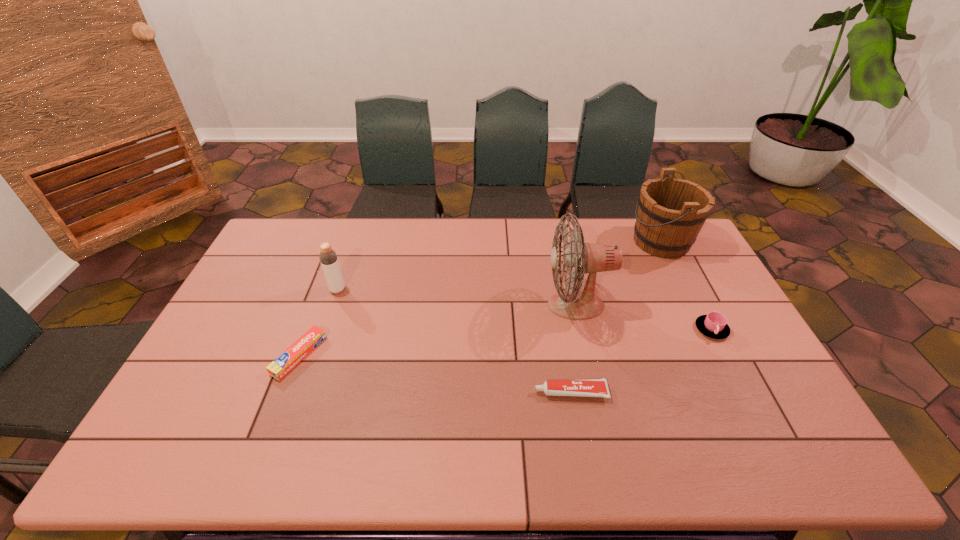
At what (x,y) coordinates should I click in order to perform the action: click on free space between the cup and the farthest object. Please return your answer as a coordinate pair (x, y). The height and width of the screenshot is (540, 960). Looking at the image, I should click on 686,286.

Find the location of a particular element. This screenshot has width=960, height=540. vacant space in between the shortest object and the tallest object is located at coordinates (438, 330).

Image resolution: width=960 pixels, height=540 pixels. What are the coordinates of `empty space between the third shortest object and the third tallest object` in the screenshot? It's located at (524, 309).

You are a GUI agent. You are given a task and a screenshot of the screen. Output one action in this format:
    pyautogui.click(x=<x>, y=<y>)
    Task: Click on the free space between the bottle and the fan
    Image resolution: width=960 pixels, height=540 pixels.
    Given the screenshot: What is the action you would take?
    pyautogui.click(x=457, y=298)

Find the location of a particular element. free space that is in between the fifth shortest object and the cup is located at coordinates (686, 286).

The width and height of the screenshot is (960, 540). I want to click on free space between the farthest object and the shorter toothpaste, so click(480, 299).

The image size is (960, 540). What are the coordinates of `empty space between the cup and the fan` in the screenshot? It's located at (643, 318).

Find the location of a particular element. empty space between the farthest object and the left toothpaste is located at coordinates (480, 299).

This screenshot has height=540, width=960. Identify the location of object that is the fifth closest to the right toothpaste. (328, 257).

Identify the location of object that is the closest one to the fan. Image resolution: width=960 pixels, height=540 pixels. (589, 387).